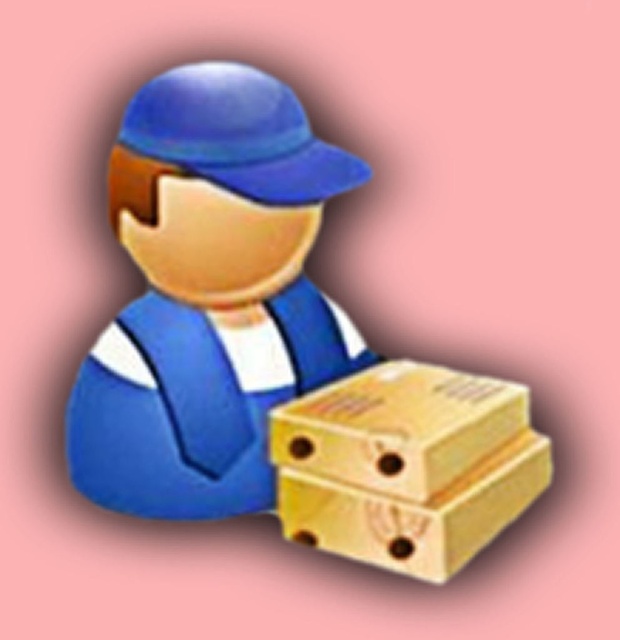
You are standing in front of the delivery person and looking at the golden box. There are two points marked on the box. The first point is at coordinates point (298,460) and the second point is at point (394,532). Which point is closer to you?

Point (298,460) is further to the camera than point (394,532), so the point closer to you is point (394,532).

You are the delivery person in the image. You need to determine if your matte blue uniform at center can fit over the wooden box at center without overlapping the edges. Based on the scene, can you confirm if the uniform is wider than the box?

The matte blue uniform at center is wider than the wooden box at center because its width surpasses the box.